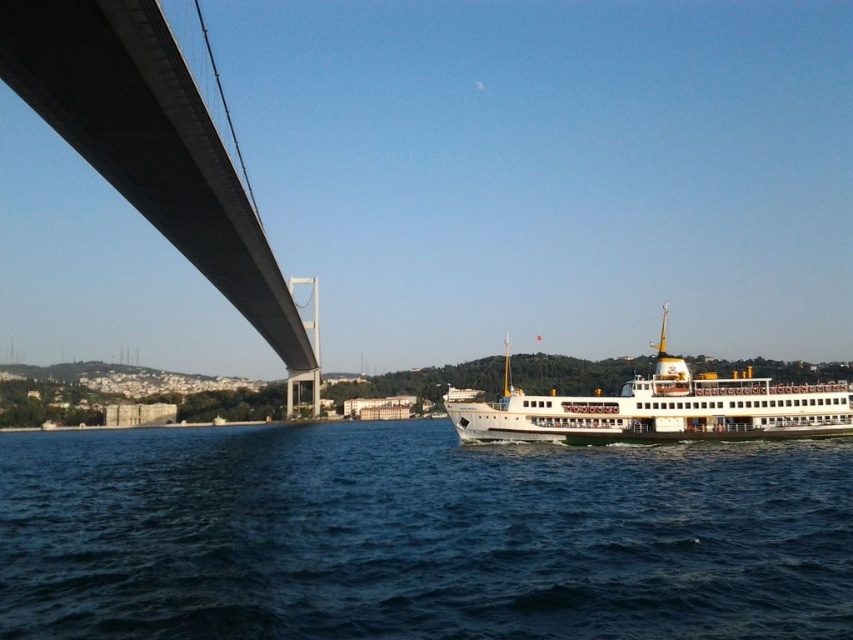
You are standing on the shore and looking at the gray concrete suspension bridge at upper left and the white glossy ferry at center. Which object is nearer to you?

The gray concrete suspension bridge at upper left is closer to the viewer than the white glossy ferry at center.

You are standing at the edge of the suspension bridge on the left side of the image. You want to throw a small pebble into the dark blue water at lower center. Based on the distance provided, will the pebble reach the water if you can throw it up to 30 meters?

The dark blue water at lower center is 28.89 meters away from the camera. Since your throwing distance is up to 30 meters, the pebble will reach the water.

You are standing on the ferry boat in the center right of the image and want to reach the suspension bridge on the left. Which point, point (201, 611) or point (109, 131), is closer to the suspension bridge?

Point (109, 131) is closer to the suspension bridge on the left because it is behind point (201, 611), which is further away.